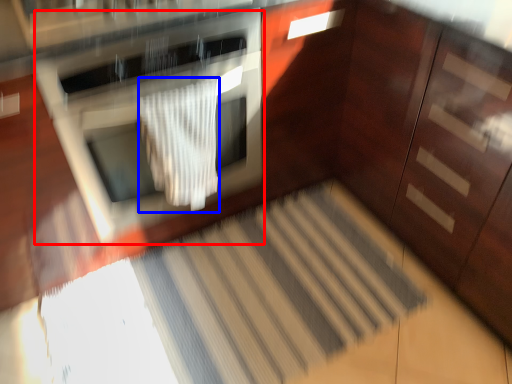
Question: Which point is closer to the camera, oven (highlighted by a red box) or blanket (highlighted by a blue box)?

Choices:
 (A) oven
 (B) blanket

Answer: (A)